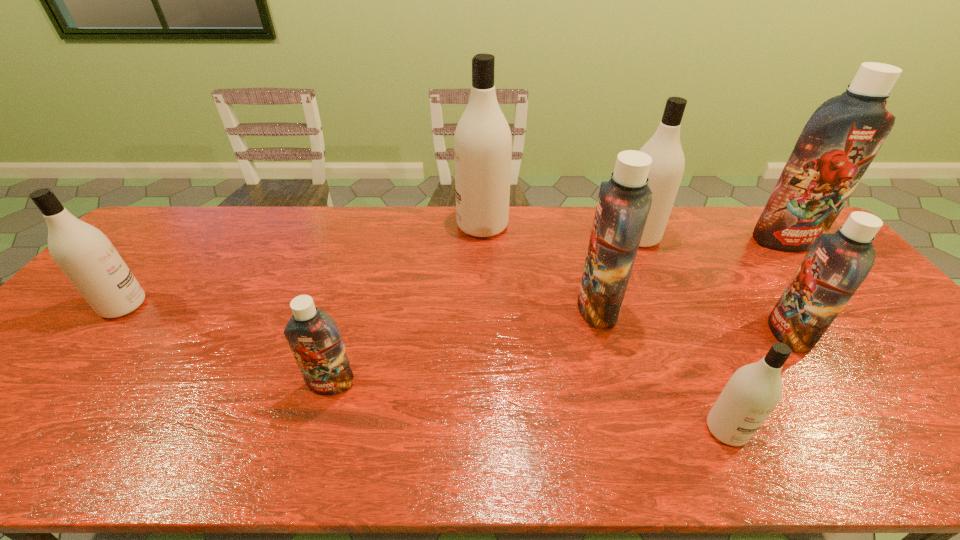
At what (x,y) coordinates should I click in order to perform the action: click on white shampoo identified as the third closest to the sixth shampoo from right to left. Please return your answer as a coordinate pair (x, y). Looking at the image, I should click on (87, 257).

Choose which blue shampoo is the second nearest neighbor to the second biggest white shampoo. Please provide its 2D coordinates. Your answer should be formatted as a tuple, i.e. [(x, y)], where the tuple contains the x and y coordinates of a point satisfying the conditions above.

[(842, 137)]

This screenshot has height=540, width=960. I want to click on the third closest blue shampoo to the rightmost object, so click(x=315, y=340).

The width and height of the screenshot is (960, 540). In order to click on free space that satisfies the following two spatial constraints: 1. on the front label of the rightmost shampoo; 2. on the front label of the second object from right to left in this screenshot , I will do `click(863, 333)`.

You are a GUI agent. You are given a task and a screenshot of the screen. Output one action in this format:
    pyautogui.click(x=<x>, y=<y>)
    Task: Click on the free space that satisfies the following two spatial constraints: 1. on the front label of the third biggest blue shampoo; 2. on the front label of the leftmost blue shampoo
    This screenshot has width=960, height=540.
    Given the screenshot: What is the action you would take?
    pyautogui.click(x=823, y=384)